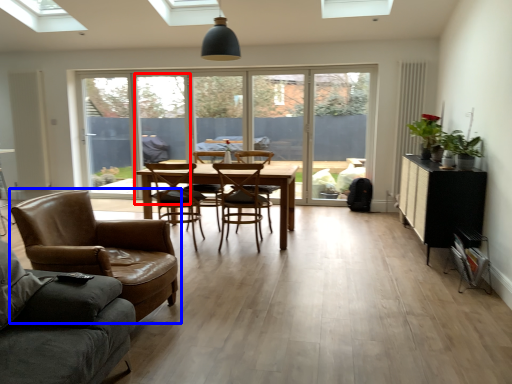
Question: Which object is closer to the camera taking this photo, screen door (highlighted by a red box) or chair (highlighted by a blue box)?

Choices:
 (A) screen door
 (B) chair

Answer: (B)